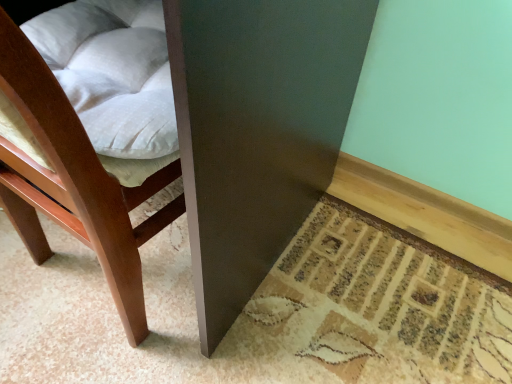
Question: Choose the correct answer: Is matte dark brown table at lower center inside matte wood chair at lower left or outside it?

Choices:
 (A) outside
 (B) inside

Answer: (A)

Question: In terms of size, does matte dark brown table at lower center appear bigger or smaller than matte wood chair at lower left?

Choices:
 (A) small
 (B) big

Answer: (B)

Question: Visually, is matte dark brown table at lower center positioned to the left or to the right of matte wood chair at lower left?

Choices:
 (A) left
 (B) right

Answer: (A)

Question: In terms of height, does matte wood chair at lower left look taller or shorter compared to matte dark brown table at lower center?

Choices:
 (A) tall
 (B) short

Answer: (B)

Question: Is matte wood chair at lower left in front of or behind matte dark brown table at lower center in the image?

Choices:
 (A) behind
 (B) front

Answer: (B)

Question: From the image's perspective, is matte wood chair at lower left positioned above or below matte dark brown table at lower center?

Choices:
 (A) below
 (B) above

Answer: (A)

Question: Visually, is matte wood chair at lower left positioned to the left or to the right of matte dark brown table at lower center?

Choices:
 (A) right
 (B) left

Answer: (A)